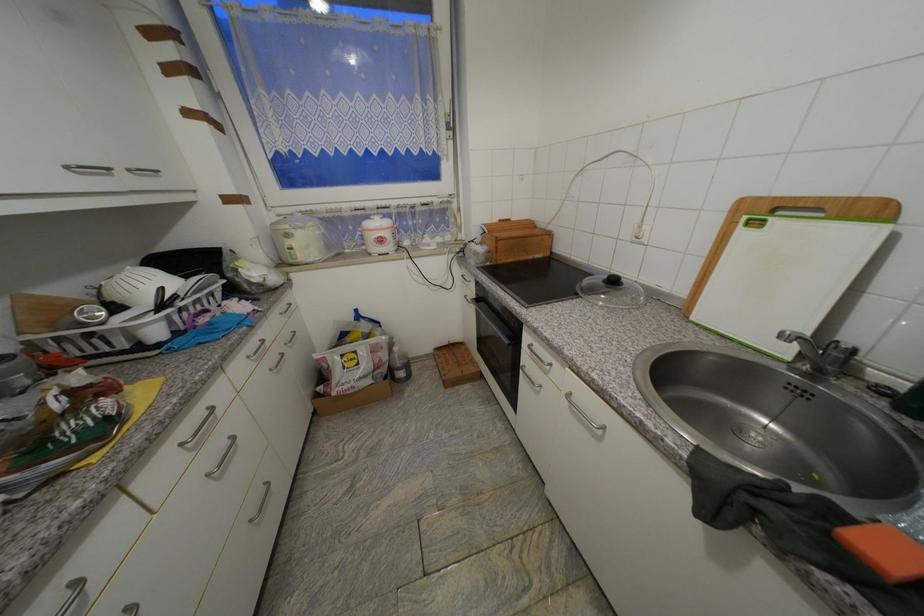
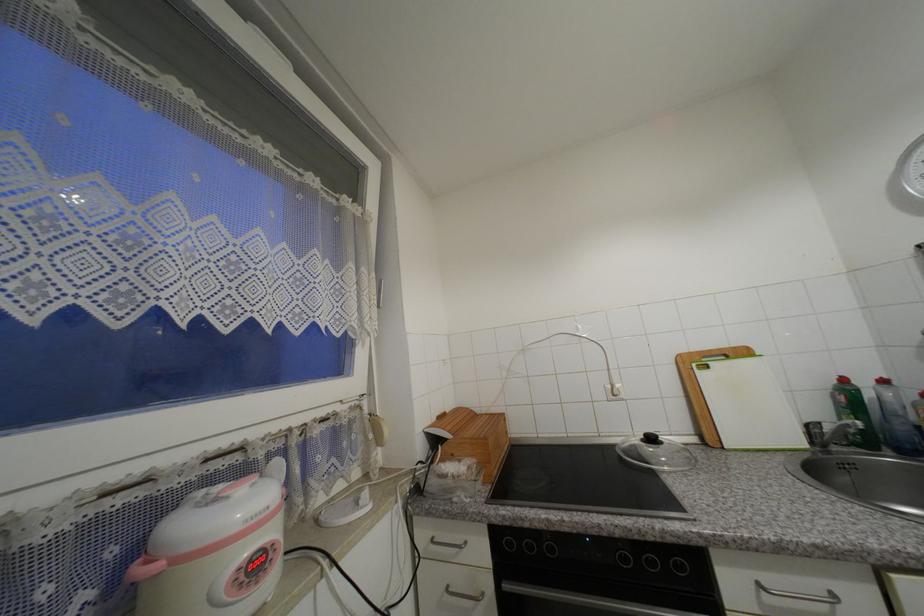
The point at (750, 219) is marked in the first image. Where is the corresponding point in the second image?

(699, 367)